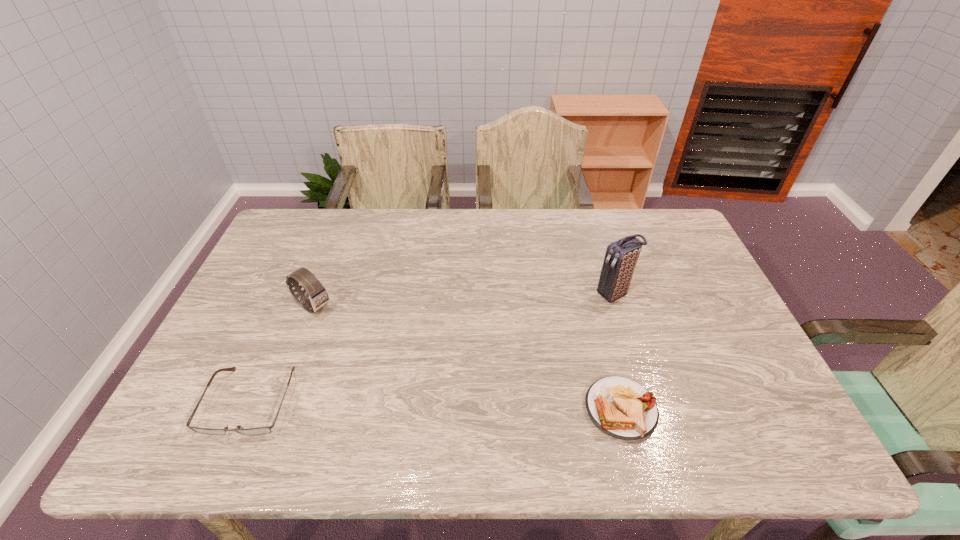
Locate an element on the screen. free location located with the zip open on the clutch bag is located at coordinates (558, 320).

Where is `spectacles at the near edge`? The height and width of the screenshot is (540, 960). spectacles at the near edge is located at coordinates (267, 429).

You are a GUI agent. You are given a task and a screenshot of the screen. Output one action in this format:
    pyautogui.click(x=<x>, y=<y>)
    Task: Click on the sandwich present at the near edge
    Image resolution: width=960 pixels, height=540 pixels.
    Given the screenshot: What is the action you would take?
    pyautogui.click(x=620, y=407)

Identify the location of spectacles situated at the left edge. (267, 429).

Find the location of a particular element. This screenshot has height=540, width=960. watch that is positioned at the left edge is located at coordinates (316, 297).

This screenshot has width=960, height=540. I want to click on object that is positioned at the near left corner, so click(x=267, y=429).

You are a GUI agent. You are given a task and a screenshot of the screen. Output one action in this format:
    pyautogui.click(x=<x>, y=<y>)
    Task: Click on the free space at the far edge
    The image size is (960, 540).
    Given the screenshot: What is the action you would take?
    pyautogui.click(x=571, y=224)

Identify the location of vacant area at the near edge of the desktop. The image size is (960, 540). (646, 383).

This screenshot has height=540, width=960. Find the location of `vacant area at the left edge`. vacant area at the left edge is located at coordinates (214, 381).

The image size is (960, 540). What are the coordinates of `vacant space at the right edge` in the screenshot? It's located at (687, 279).